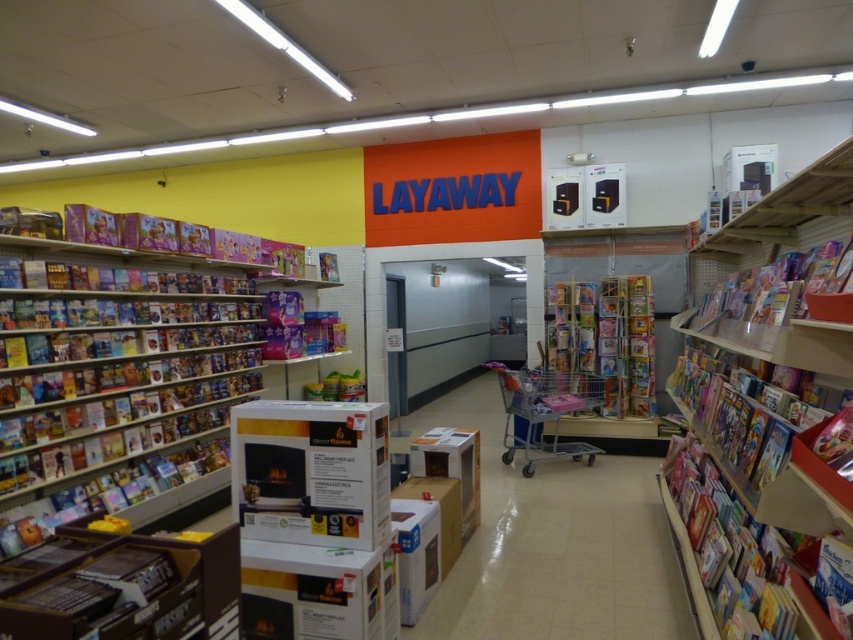
Question: Is wooden bookshelf at upper right above metallic silver shopping cart at center?

Choices:
 (A) no
 (B) yes

Answer: (B)

Question: Does cardboard boxes at center lie behind metallic silver shopping cart at center?

Choices:
 (A) no
 (B) yes

Answer: (A)

Question: Does multicolored cardboard books at left have a greater width compared to metallic silver shopping cart at center?

Choices:
 (A) yes
 (B) no

Answer: (B)

Question: Which point is farther from the camera taking this photo?

Choices:
 (A) (x=840, y=502)
 (B) (x=584, y=384)

Answer: (B)

Question: Which is farther from the cardboard boxes at center?

Choices:
 (A) multicolored cardboard books at left
 (B) wooden bookshelf at upper right

Answer: (A)

Question: Considering the real-world distances, which object is closest to the wooden bookshelf at upper right?

Choices:
 (A) metallic silver shopping cart at center
 (B) cardboard boxes at center
 (C) multicolored cardboard books at left

Answer: (B)